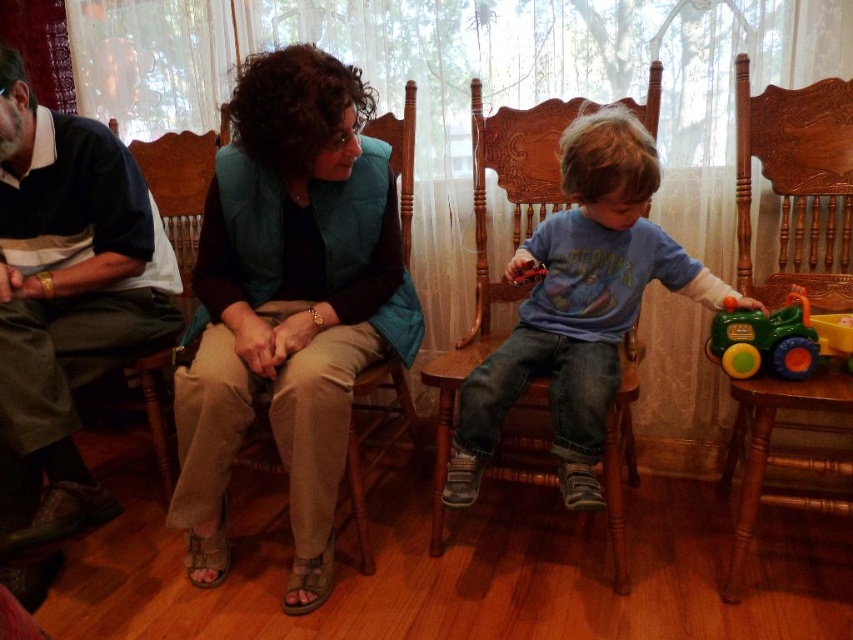
Does wooden carved rocking chair at right have a greater height compared to brown wood chair at left?

Yes.

How distant is wooden carved rocking chair at right from brown wood chair at left?

wooden carved rocking chair at right is 1.54 meters away from brown wood chair at left.

Find the location of a particular element. The width and height of the screenshot is (853, 640). wooden carved rocking chair at right is located at coordinates (798, 188).

Is blue cotton shirt at center to the right of brown wood chair at left from the viewer's perspective?

Yes, blue cotton shirt at center is to the right of brown wood chair at left.

Does blue cotton shirt at center have a lesser height compared to brown wood chair at left?

Indeed, blue cotton shirt at center has a lesser height compared to brown wood chair at left.

Which is behind, point (630, 268) or point (166, 492)?

The point (166, 492) is behind.

The width and height of the screenshot is (853, 640). What are the coordinates of `blue cotton shirt at center` in the screenshot? It's located at (579, 307).

Locate an element on the screen. The image size is (853, 640). dark blue shirt at left is located at coordinates (68, 289).

Is point (41, 196) closer to viewer compared to point (752, 320)?

No, (41, 196) is further to viewer.

Is point (126, 166) closer to camera compared to point (779, 333)?

That is False.

The width and height of the screenshot is (853, 640). Find the location of `dark blue shirt at left`. dark blue shirt at left is located at coordinates (68, 289).